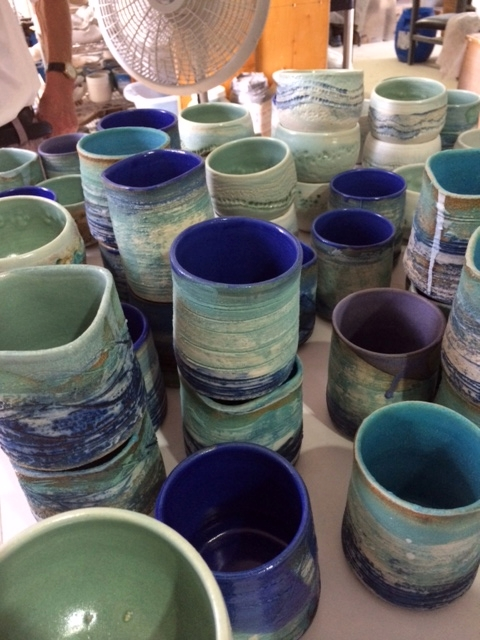
Identify the location of fan. This screenshot has width=480, height=640. (166, 33).